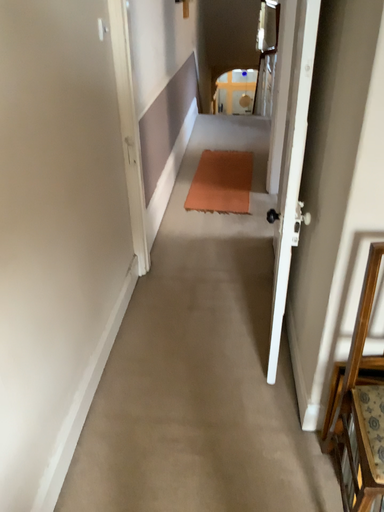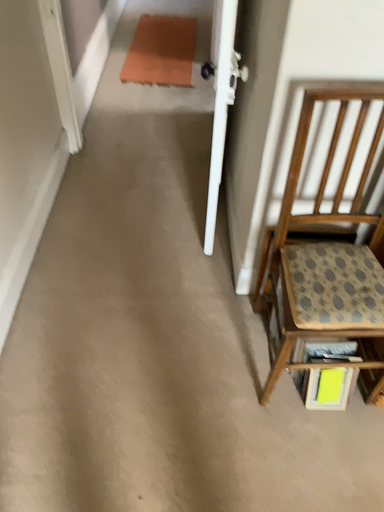
Question: Which way did the camera rotate in the video?

Choices:
 (A) rotated right
 (B) rotated left

Answer: (A)